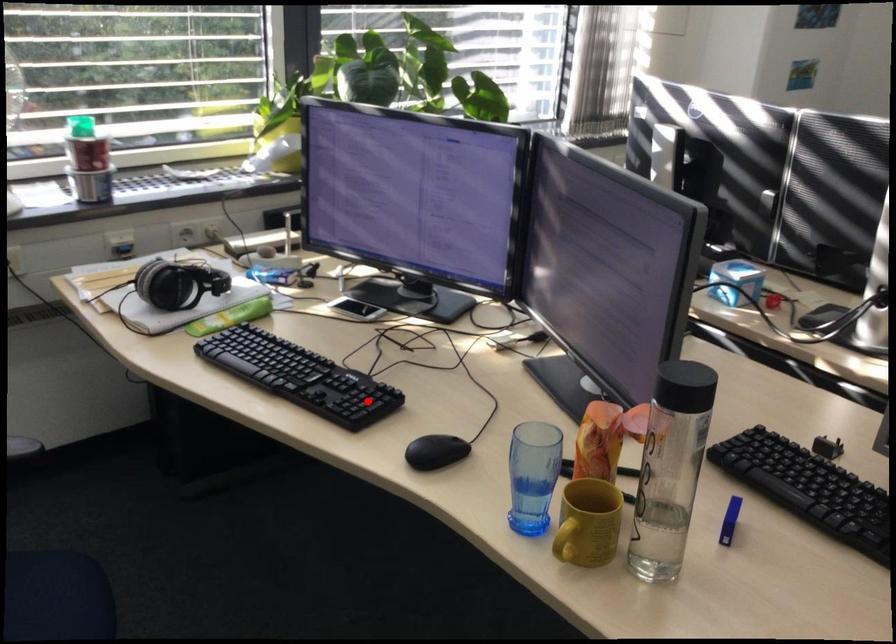
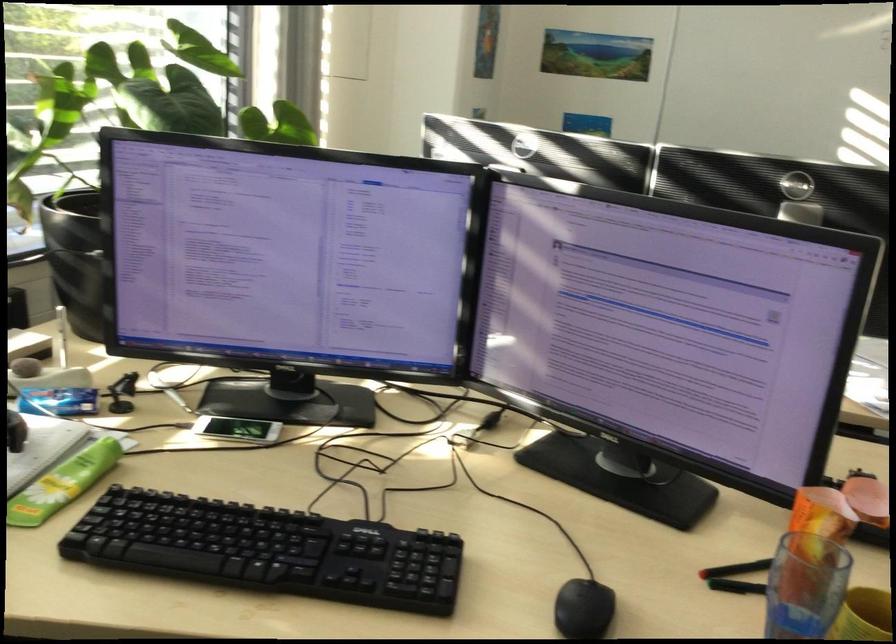
Question: I am providing you with two images of the same scene from different viewpoints. Given a red point in image1, look at the same physical point in image2. Is it:

Choices:
 (A) Closer to the viewpoint
 (B) Farther from the viewpoint

Answer: (A)